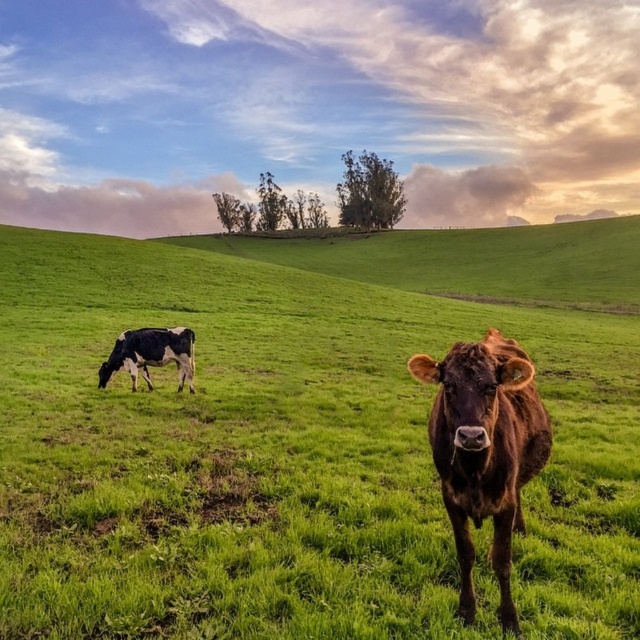
You are a farmer planning to place a new fence around the brown glossy bull at center. Given that the green grass pasture at center is wider than the bull, will the pasture be wide enough to accommodate the bull comfortably?

The green grass pasture at center is wider than the brown glossy bull at center, so yes, the pasture is wide enough to accommodate the bull comfortably.

You are standing in the pasture and want to walk from the black and white spotted cow at left to the green grass pasture at center. Which direction should you move?

To move from the black and white spotted cow at left to the green grass pasture at center, you should move to the right since the green grass pasture at center is located to the right of the black and white spotted cow at left.